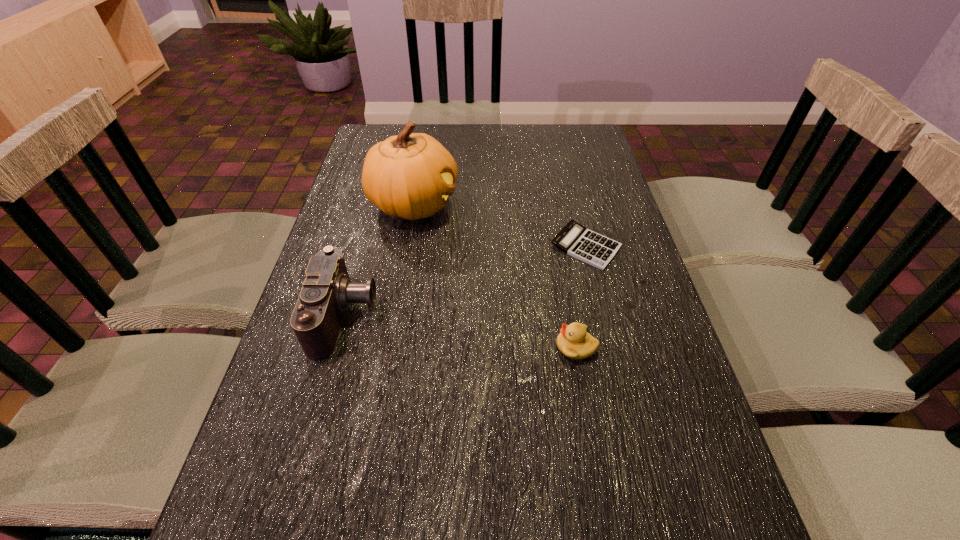
In order to click on pumpkin located at the left edge in this screenshot , I will do `click(410, 175)`.

Where is `camera present at the left edge`? Image resolution: width=960 pixels, height=540 pixels. camera present at the left edge is located at coordinates (327, 292).

Where is `duckling that is at the right edge`? The width and height of the screenshot is (960, 540). duckling that is at the right edge is located at coordinates (574, 341).

Find the location of `calculator located in the right edge section of the desktop`. calculator located in the right edge section of the desktop is located at coordinates (574, 239).

Identify the location of free space at the far edge. (501, 144).

In the image, there is a desktop. In order to click on blank space at the left edge in this screenshot , I will do `click(293, 354)`.

The width and height of the screenshot is (960, 540). In the image, there is a desktop. Identify the location of free space at the right edge. (602, 346).

The image size is (960, 540). Find the location of `vacant region at the far right corner`. vacant region at the far right corner is located at coordinates click(597, 144).

Where is `unoccupied position between the third tallest object and the pumpkin`? The width and height of the screenshot is (960, 540). unoccupied position between the third tallest object and the pumpkin is located at coordinates (495, 275).

Find the location of a particular element. The height and width of the screenshot is (540, 960). vacant area between the tallest object and the calculator is located at coordinates (500, 226).